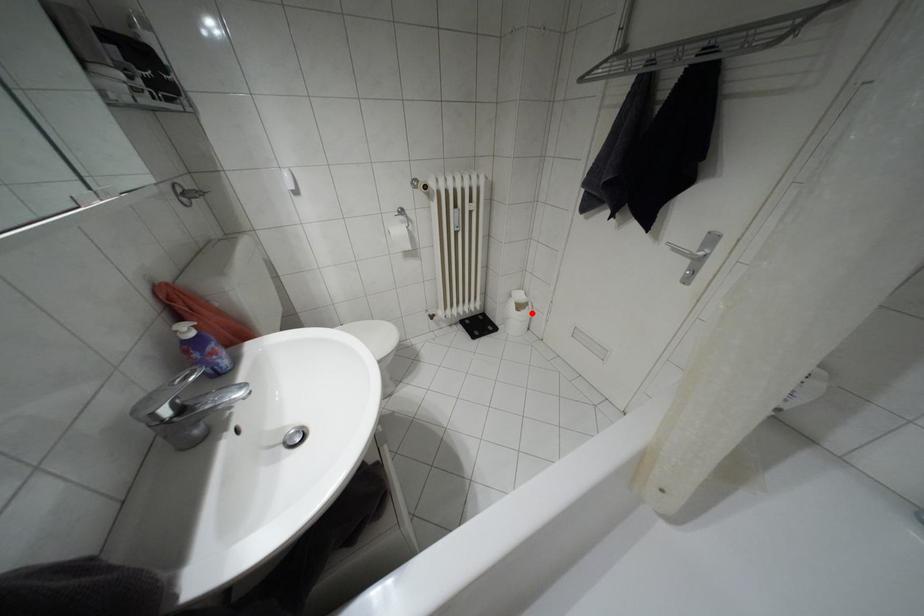
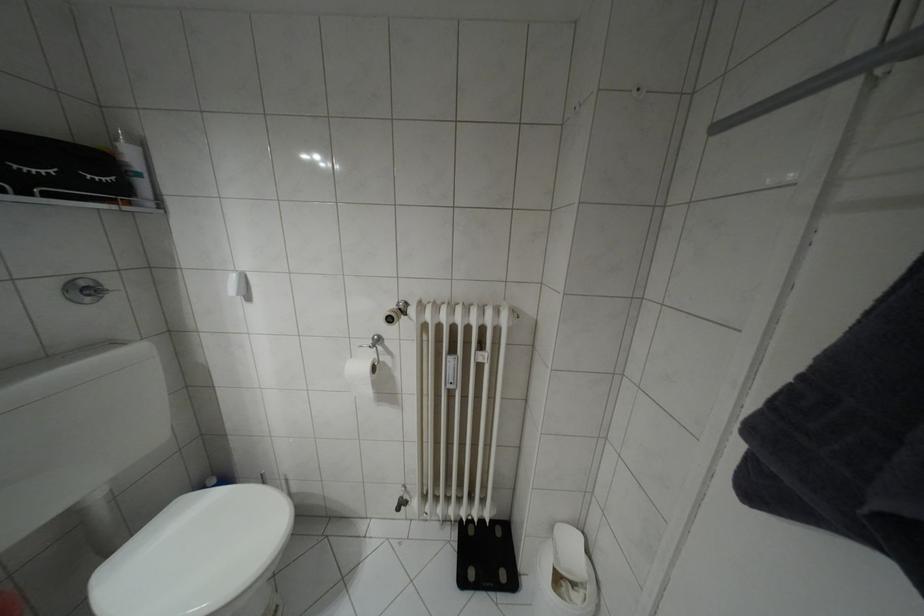
Question: I am providing you with two images of the same scene from different viewpoints. In image1, a red point is highlighted. Considering the same 3D point in image2, which of the following is correct?

Choices:
 (A) It is closer
 (B) It is farther

Answer: (A)